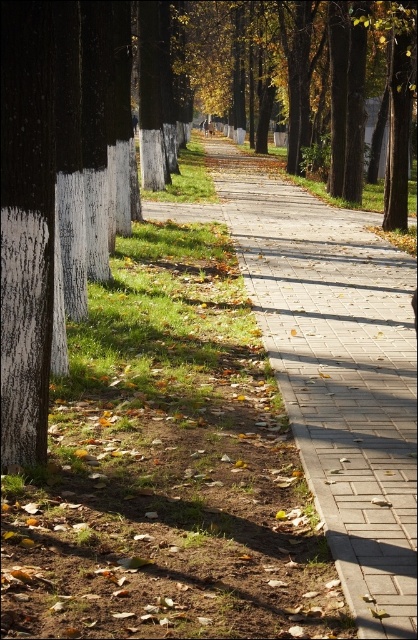
Is point (338, 280) closer to camera compared to point (91, 77)?

That is False.

Does point (336, 349) lie behind point (38, 96)?

Yes, it is.

I want to click on paved concrete path at center, so click(336, 372).

The height and width of the screenshot is (640, 418). I want to click on paved concrete path at center, so click(336, 372).